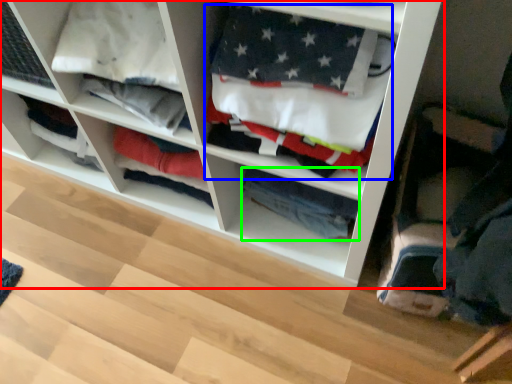
Question: Based on their relative distances, which object is farther from shelf (highlighted by a red box)? Choose from clothing (highlighted by a blue box) and clothing (highlighted by a green box).

Choices:
 (A) clothing
 (B) clothing

Answer: (B)